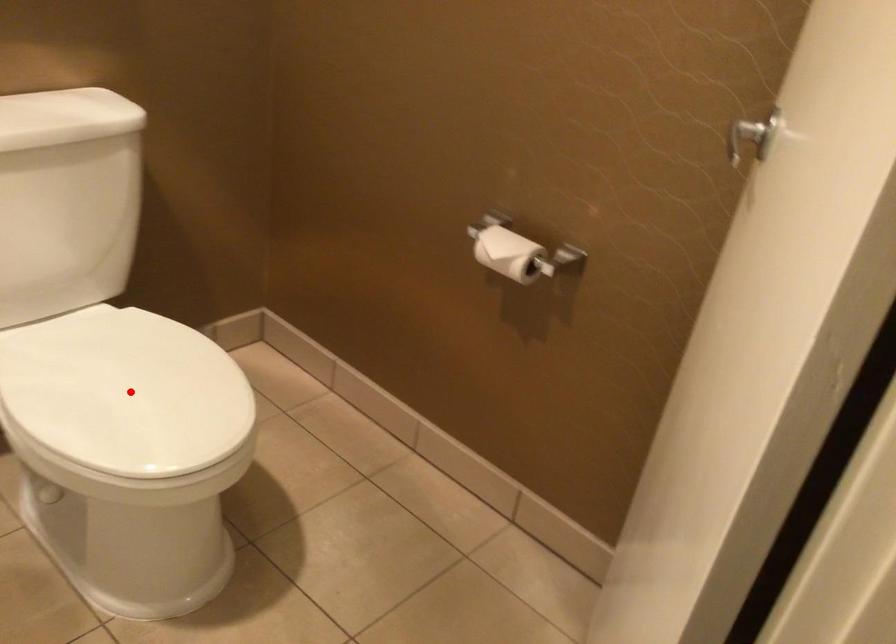
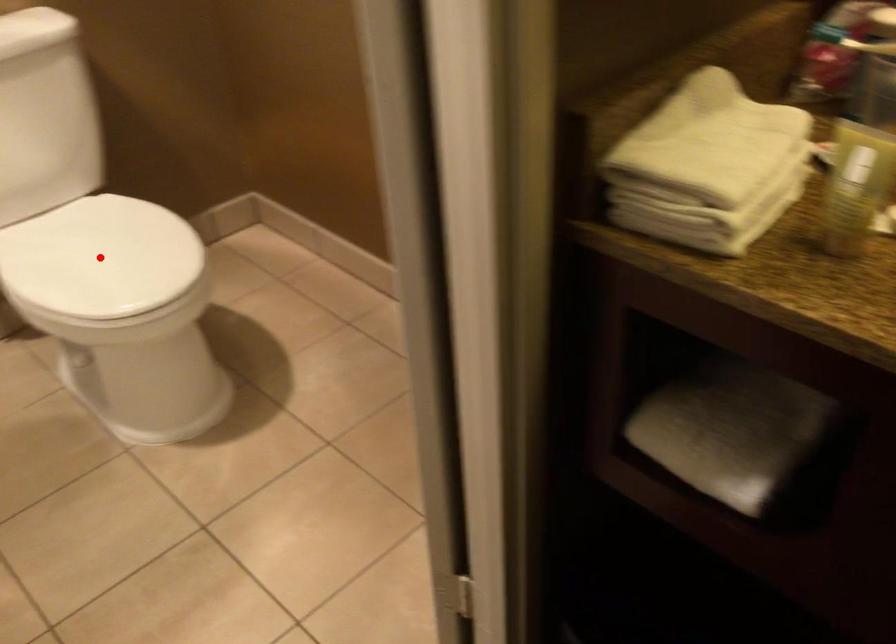
I am providing you with two images of the same scene from different viewpoints. A red point is marked on the first image and another point is marked on the second image. Does the point marked in image1 correspond to the same location as the one in image2?

Yes